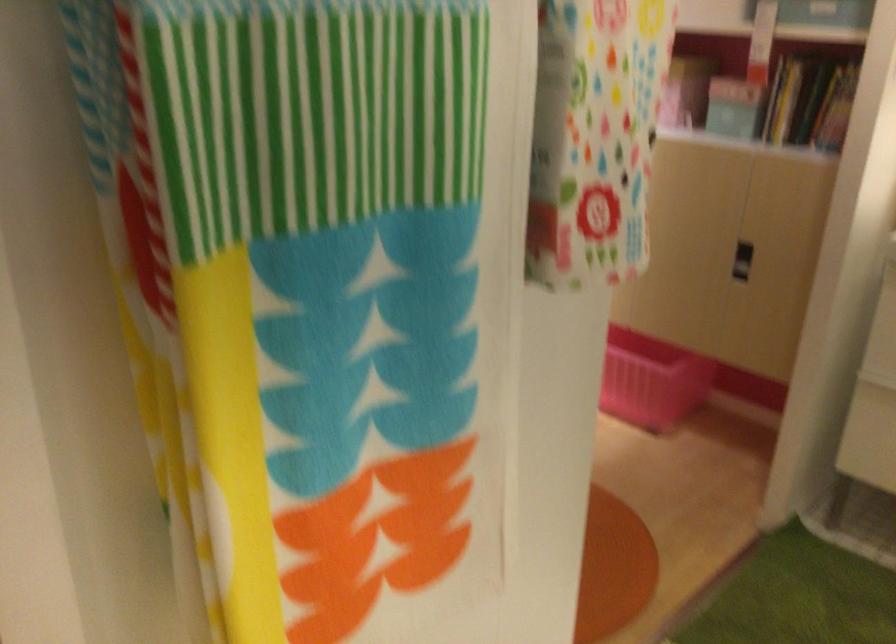
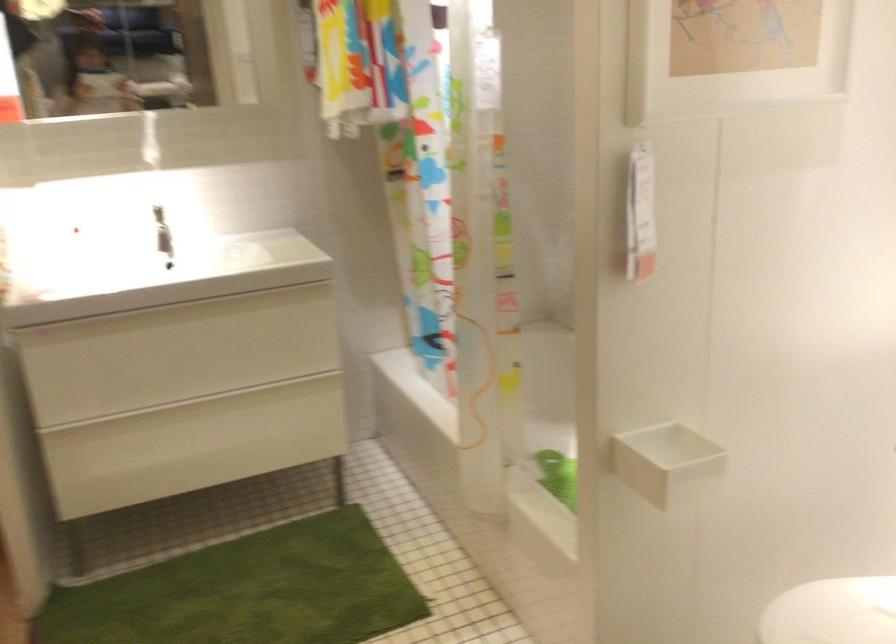
Question: The camera is either moving clockwise (left) or counter-clockwise (right) around the object. The first image is from the beginning of the video and the second image is from the end. Is the camera moving left or right when shooting the video?

Choices:
 (A) Left
 (B) Right

Answer: (A)